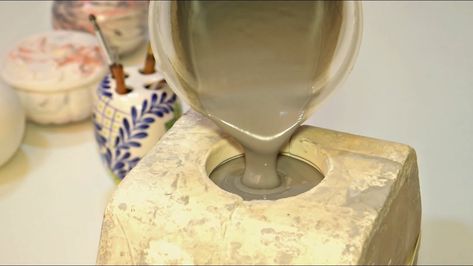
The width and height of the screenshot is (473, 266). Find the location of `small white jar with lid`. small white jar with lid is located at coordinates (63, 114).